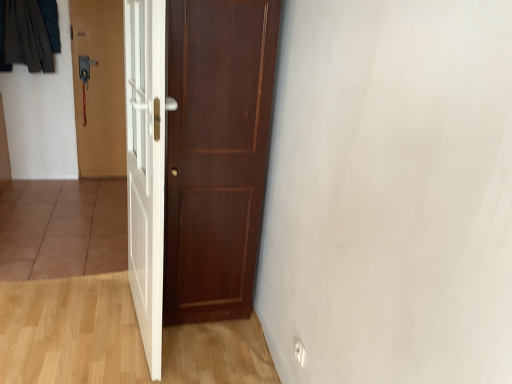
The height and width of the screenshot is (384, 512). What are the coordinates of `dark gray fabric at upper left` in the screenshot? It's located at (28, 34).

The image size is (512, 384). Describe the element at coordinates (99, 86) in the screenshot. I see `wooden door at left, the first door viewed from the left` at that location.

The image size is (512, 384). Find the location of `matte wood door at center, which is the 3th door in left-to-right order`. matte wood door at center, which is the 3th door in left-to-right order is located at coordinates (195, 157).

Identify the location of dark gray fabric at upper left. (28, 34).

Considering the relative positions of dark gray fabric at upper left and matte wood door at center, marked as the second door in a front-to-back arrangement, in the image provided, is dark gray fabric at upper left to the right of matte wood door at center, marked as the second door in a front-to-back arrangement, from the viewer's perspective?

Incorrect, dark gray fabric at upper left is not on the right side of matte wood door at center, marked as the second door in a front-to-back arrangement.

Consider the image. From a real-world perspective, is dark gray fabric at upper left above or below matte wood door at center, which appears as the second door when viewed from the back?

dark gray fabric at upper left is situated higher than matte wood door at center, which appears as the second door when viewed from the back, in the real world.

Which of these two, dark gray fabric at upper left or matte wood door at center, which is the 3th door in left-to-right order, is thinner?

dark gray fabric at upper left is thinner.

Between point (12, 17) and point (216, 155), which one is positioned behind?

The point (12, 17) is behind.

Where is `the 1st door to the right when counting from the wooden door at left, the third door positioned from the right`? The height and width of the screenshot is (384, 512). the 1st door to the right when counting from the wooden door at left, the third door positioned from the right is located at coordinates (146, 167).

In the scene shown: Would you consider wooden door at left, the third door positioned from the right, to be distant from white glossy door at center, positioned as the second door in right-to-left order?

Yes, wooden door at left, the third door positioned from the right, is far from white glossy door at center, positioned as the second door in right-to-left order.

Based on the photo, is wooden door at left, the third door positioned from the right, closer to camera compared to white glossy door at center, which is the first door from front to back?

No.

Visually, is wooden door at left, arranged as the first door when viewed from the back, positioned to the left or to the right of white glossy door at center, which is counted as the 2th door, starting from the left?

In the image, wooden door at left, arranged as the first door when viewed from the back, appears on the left side of white glossy door at center, which is counted as the 2th door, starting from the left.

Is white glossy door at center, which is the first door from front to back, not near wooden door at left, arranged as the first door when viewed from the back?

Yes, white glossy door at center, which is the first door from front to back, and wooden door at left, arranged as the first door when viewed from the back, are quite far apart.

Is white glossy door at center, the third door when ordered from back to front, positioned beyond the bounds of wooden door at left, arranged as the first door when viewed from the back?

Yes, white glossy door at center, the third door when ordered from back to front, is located beyond the bounds of wooden door at left, arranged as the first door when viewed from the back.

Considering the positions of point (155, 44) and point (97, 131), is point (155, 44) closer or farther from the camera than point (97, 131)?

Point (155, 44).

Is white glossy door at center, which is counted as the 2th door, starting from the left, thinner than wooden door at left, the third door positioned from the right?

Incorrect, the width of white glossy door at center, which is counted as the 2th door, starting from the left, is not less than that of wooden door at left, the third door positioned from the right.

Can you tell me how much matte wood door at center, which is the 3th door in left-to-right order, and wooden door at left, the first door viewed from the left, differ in facing direction?

3.99e-05 degrees.

Is matte wood door at center, marked as the second door in a front-to-back arrangement, inside the boundaries of wooden door at left, arranged as the first door when viewed from the back, or outside?

matte wood door at center, marked as the second door in a front-to-back arrangement, is not enclosed by wooden door at left, arranged as the first door when viewed from the back.

Considering the sizes of matte wood door at center, placed as the 1th door when sorted from right to left, and wooden door at left, arranged as the first door when viewed from the back, in the image, is matte wood door at center, placed as the 1th door when sorted from right to left, taller or shorter than wooden door at left, arranged as the first door when viewed from the back,?

Considering their sizes, matte wood door at center, placed as the 1th door when sorted from right to left, has more height than wooden door at left, arranged as the first door when viewed from the back.

Identify the location of clothing that is above the matte wood door at center, which appears as the second door when viewed from the back (from a real-world perspective). The width and height of the screenshot is (512, 384). (28, 34).

Is matte wood door at center, which appears as the second door when viewed from the back, facing away from dark gray fabric at upper left?

No, matte wood door at center, which appears as the second door when viewed from the back, is not facing away from dark gray fabric at upper left.

Considering the positions of point (136, 218) and point (37, 38), is point (136, 218) closer or farther from the camera than point (37, 38)?

Point (136, 218) is closer to the camera than point (37, 38).

Between matte wood door at center, marked as the second door in a front-to-back arrangement, and dark gray fabric at upper left, which one appears on the right side from the viewer's perspective?

matte wood door at center, marked as the second door in a front-to-back arrangement, is more to the right.

Is wooden door at left, positioned as the 3th door in front-to-back order, not close to dark gray fabric at upper left?

No.

Which is closer, (x=118, y=72) or (x=16, y=2)?

Point (x=118, y=72) is positioned farther from the camera compared to point (x=16, y=2).

Between wooden door at left, arranged as the first door when viewed from the back, and dark gray fabric at upper left, which one has larger size?

Bigger between the two is wooden door at left, arranged as the first door when viewed from the back.

Is wooden door at left, positioned as the 3th door in front-to-back order, turned away from dark gray fabric at upper left?

No.

Is white glossy door at center, which is counted as the 2th door, starting from the left, behind matte wood door at center, which appears as the second door when viewed from the back?

That is False.

Does point (157, 141) appear closer or farther from the camera than point (158, 40)?

Point (157, 141).

Is white glossy door at center, which is counted as the 2th door, starting from the left, inside or outside of matte wood door at center, which appears as the second door when viewed from the back?

white glossy door at center, which is counted as the 2th door, starting from the left, is located beyond the bounds of matte wood door at center, which appears as the second door when viewed from the back.

What are the coordinates of `clothing above the matte wood door at center, marked as the second door in a front-to-back arrangement (from a real-world perspective)` in the screenshot? It's located at (28, 34).

Where is `door on the left of white glossy door at center, the third door when ordered from back to front`? This screenshot has height=384, width=512. door on the left of white glossy door at center, the third door when ordered from back to front is located at coordinates (99, 86).

When comparing their distances from white glossy door at center, which is counted as the 2th door, starting from the left, does matte wood door at center, marked as the second door in a front-to-back arrangement, or dark gray fabric at upper left seem closer?

matte wood door at center, marked as the second door in a front-to-back arrangement, is closer to white glossy door at center, which is counted as the 2th door, starting from the left.

Looking at the image, which one is located closer to matte wood door at center, which is the 3th door in left-to-right order, white glossy door at center, which is the first door from front to back, or dark gray fabric at upper left?

white glossy door at center, which is the first door from front to back, is closer to matte wood door at center, which is the 3th door in left-to-right order.

Based on their spatial positions, is white glossy door at center, the third door when ordered from back to front, or wooden door at left, arranged as the first door when viewed from the back, further from dark gray fabric at upper left?

white glossy door at center, the third door when ordered from back to front, is further to dark gray fabric at upper left.

Estimate the real-world distances between objects in this image. Which object is further from white glossy door at center, which is the first door from front to back, dark gray fabric at upper left or matte wood door at center, which is the 3th door in left-to-right order?

dark gray fabric at upper left is further to white glossy door at center, which is the first door from front to back.

Which object lies further to the anchor point white glossy door at center, which is the first door from front to back, wooden door at left, arranged as the first door when viewed from the back, or matte wood door at center, which is the 3th door in left-to-right order?

Among the two, wooden door at left, arranged as the first door when viewed from the back, is located further to white glossy door at center, which is the first door from front to back.

Considering their positions, is white glossy door at center, which is counted as the 2th door, starting from the left, positioned further to matte wood door at center, placed as the 1th door when sorted from right to left, than wooden door at left, the first door viewed from the left?

wooden door at left, the first door viewed from the left, is positioned further to the anchor matte wood door at center, placed as the 1th door when sorted from right to left.

Which object lies nearer to the anchor point wooden door at left, arranged as the first door when viewed from the back, dark gray fabric at upper left or white glossy door at center, which is the first door from front to back?

dark gray fabric at upper left.

Looking at the image, which one is located further to matte wood door at center, marked as the second door in a front-to-back arrangement, wooden door at left, arranged as the first door when viewed from the back, or white glossy door at center, which is counted as the 2th door, starting from the left?

Based on the image, wooden door at left, arranged as the first door when viewed from the back, appears to be further to matte wood door at center, marked as the second door in a front-to-back arrangement.

The width and height of the screenshot is (512, 384). Identify the location of door positioned between white glossy door at center, which is counted as the 2th door, starting from the left, and dark gray fabric at upper left from near to far. (195, 157).

This screenshot has height=384, width=512. Identify the location of door between white glossy door at center, positioned as the second door in right-to-left order, and wooden door at left, the first door viewed from the left, from front to back. (195, 157).

Where is `clothing located between white glossy door at center, the third door when ordered from back to front, and wooden door at left, arranged as the first door when viewed from the back, in the depth direction`? This screenshot has height=384, width=512. clothing located between white glossy door at center, the third door when ordered from back to front, and wooden door at left, arranged as the first door when viewed from the back, in the depth direction is located at coordinates (28, 34).

You are a GUI agent. You are given a task and a screenshot of the screen. Output one action in this format:
    pyautogui.click(x=<x>, y=<y>)
    Task: Click on the clothing between matte wood door at center, marked as the second door in a front-to-back arrangement, and wooden door at left, the first door viewed from the left, along the z-axis
    
    Given the screenshot: What is the action you would take?
    pyautogui.click(x=28, y=34)